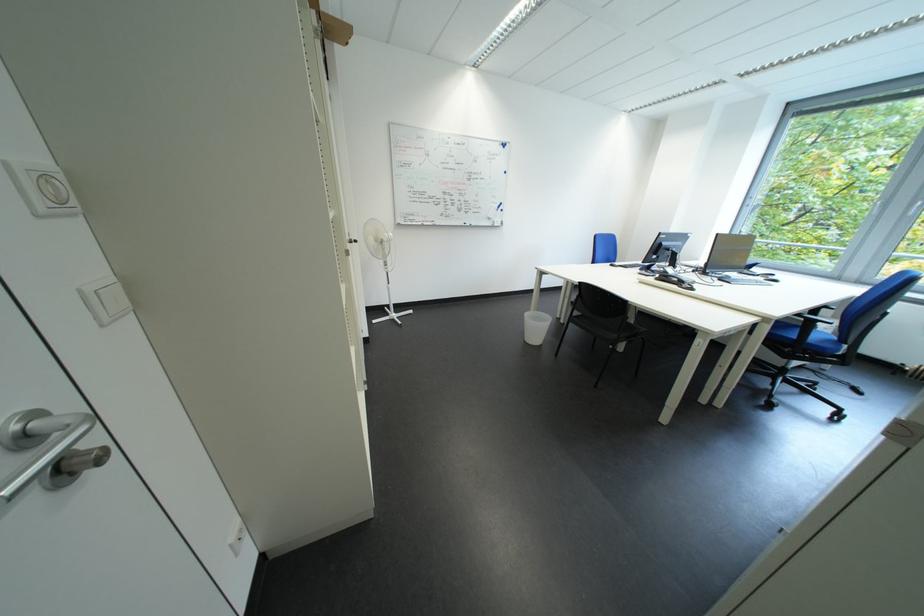
Where is `white light switch`? The width and height of the screenshot is (924, 616). white light switch is located at coordinates (104, 300).